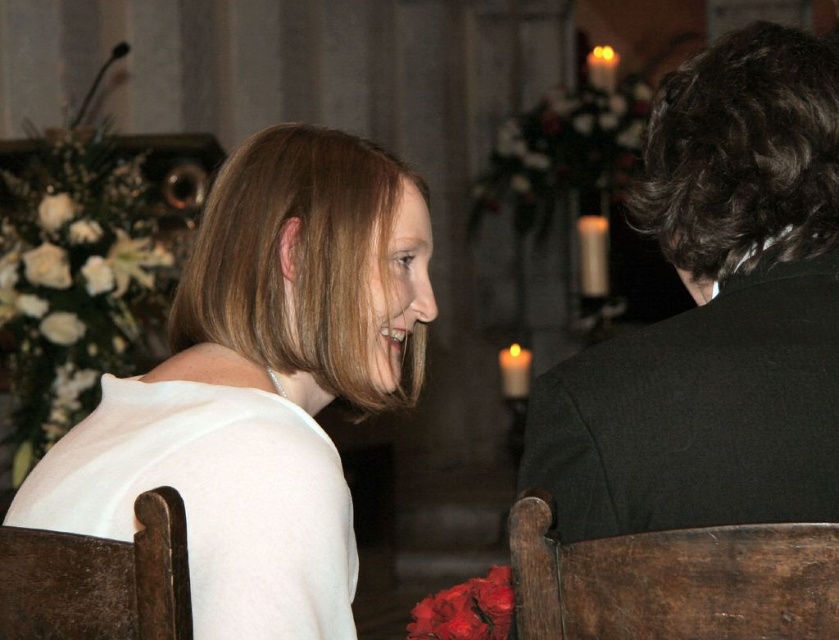
Question: Does white satin dress at upper left appear on the right side of dark brown wooden chair at right?

Choices:
 (A) yes
 (B) no

Answer: (B)

Question: Based on their relative distances, which object is farther from the black wool coat at right?

Choices:
 (A) dark brown wooden chair at right
 (B) wooden chair at lower left

Answer: (B)

Question: Does black wool coat at right come behind wooden chair at lower left?

Choices:
 (A) yes
 (B) no

Answer: (B)

Question: Can you confirm if white satin dress at upper left is smaller than dark brown wooden chair at right?

Choices:
 (A) no
 (B) yes

Answer: (A)

Question: Which object is positioned closest to the black wool coat at right?

Choices:
 (A) wooden chair at lower left
 (B) dark brown wooden chair at right

Answer: (B)

Question: Which object is closer to the camera taking this photo?

Choices:
 (A) wooden chair at lower left
 (B) white satin dress at upper left
 (C) black wool coat at right
 (D) dark brown wooden chair at right

Answer: (D)